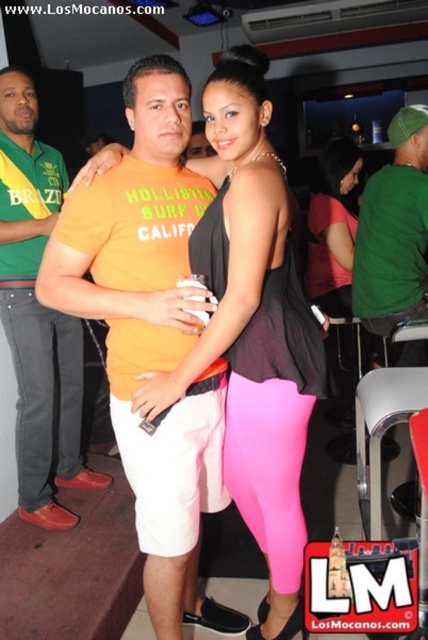
Who is lower down, orange cotton t-shirt at center or matte black top at center?

orange cotton t-shirt at center is lower down.

Is point (202, 410) more distant than point (264, 264)?

Yes, point (202, 410) is behind point (264, 264).

The image size is (428, 640). In order to click on orange cotton t-shirt at center in this screenshot , I will do `click(151, 333)`.

Between matte black top at center and matte yellow t-shirt at center, which one appears on the left side from the viewer's perspective?

From the viewer's perspective, matte yellow t-shirt at center appears more on the left side.

Does point (290, 465) come in front of point (18, 481)?

Yes, it is.

Is point (282, 179) closer to camera compared to point (71, 445)?

Yes, it is in front of point (71, 445).

The image size is (428, 640). Identify the location of matte black top at center. (255, 332).

Can you confirm if orange cotton t-shirt at center is positioned to the right of matte yellow t-shirt at center?

Correct, you'll find orange cotton t-shirt at center to the right of matte yellow t-shirt at center.

Who is more distant from viewer, (180, 340) or (26, 300)?

Positioned behind is point (26, 300).

Locate an element on the screen. The image size is (428, 640). orange cotton t-shirt at center is located at coordinates (151, 333).